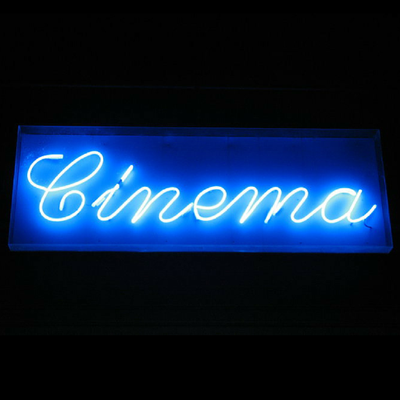
At what (x,y) coordinates should I click in order to perform the action: click on neon sign. Please return your answer as a coordinate pair (x, y). The image size is (400, 400). Looking at the image, I should click on (63, 237).